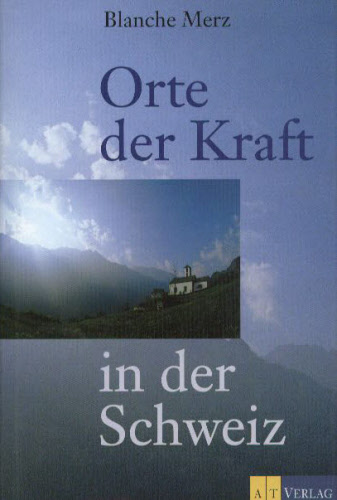
At what (x,y) coordinates should I click in order to perform the action: click on chimney. Please return your answer as a coordinate pair (x, y). Looking at the image, I should click on (186, 273).